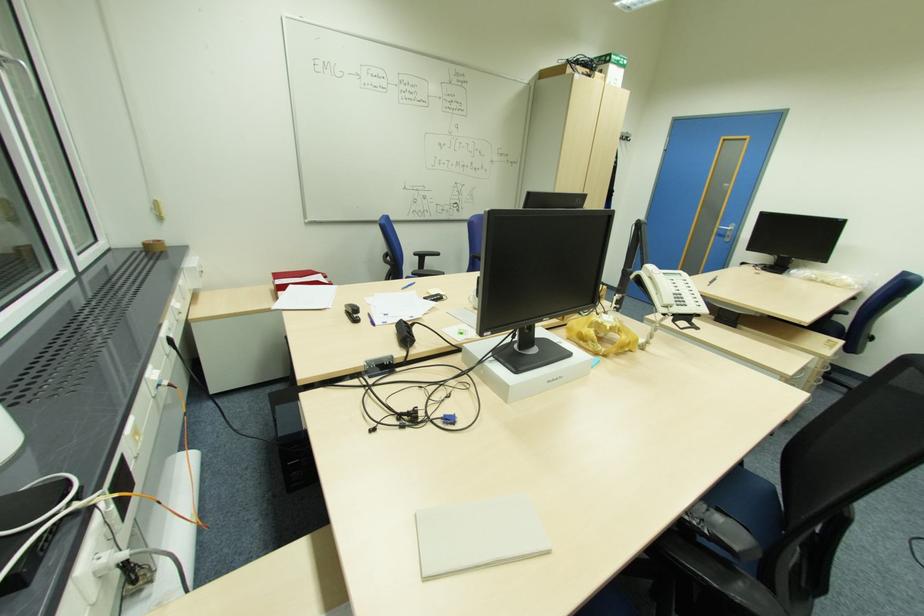
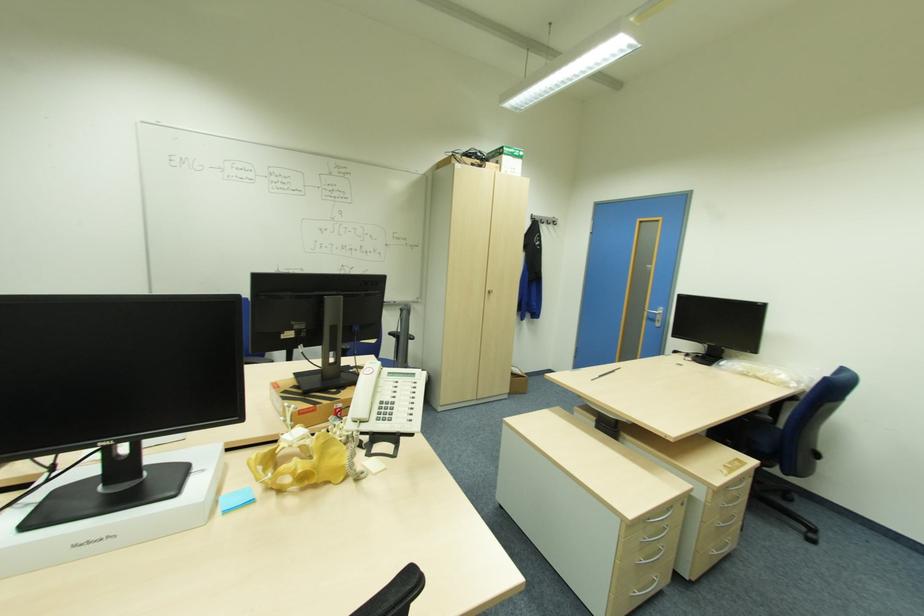
Where in the second image is the point corresponding to [670,306] from the first image?

(359, 422)